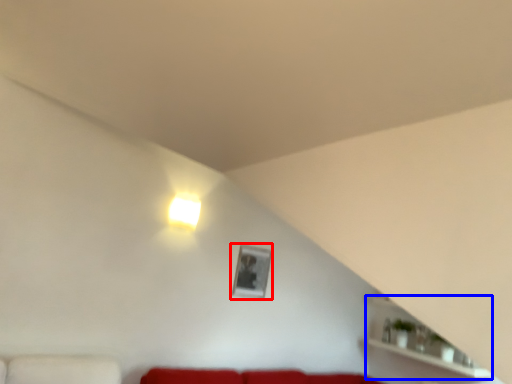
Question: Which point is closer to the camera, picture frame (highlighted by a red box) or shelf (highlighted by a blue box)?

Choices:
 (A) picture frame
 (B) shelf

Answer: (B)